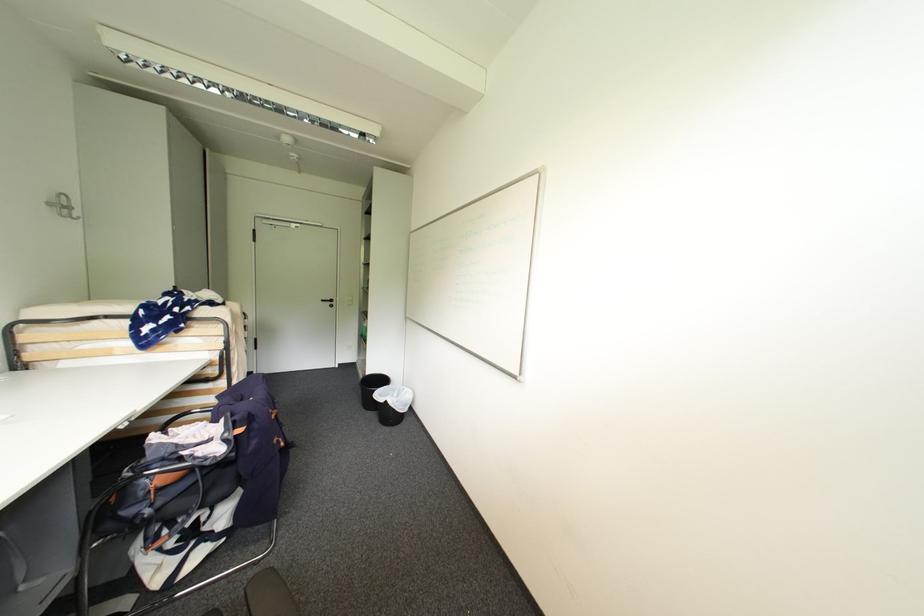
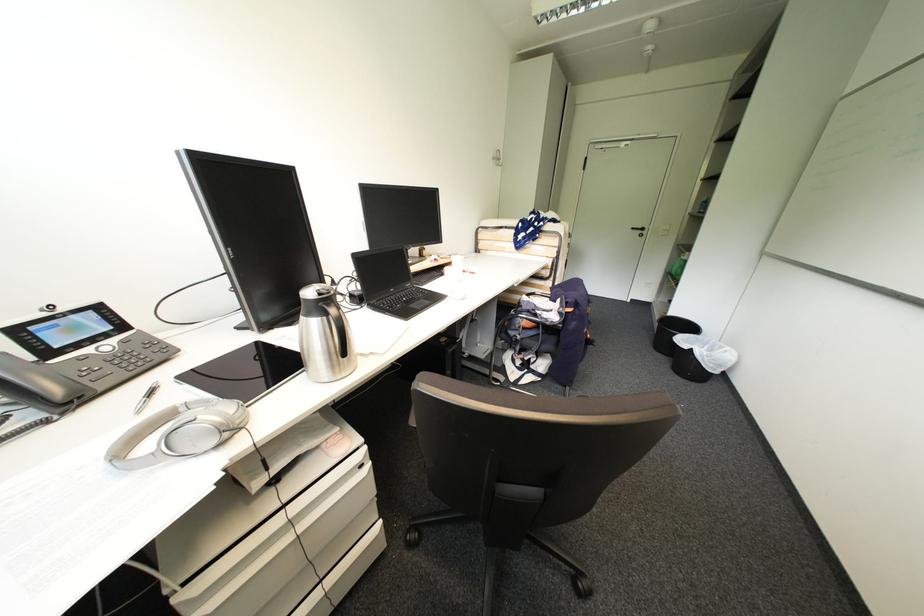
Where in the second image is the point corresponding to [371,410] from the first image?

(660, 351)